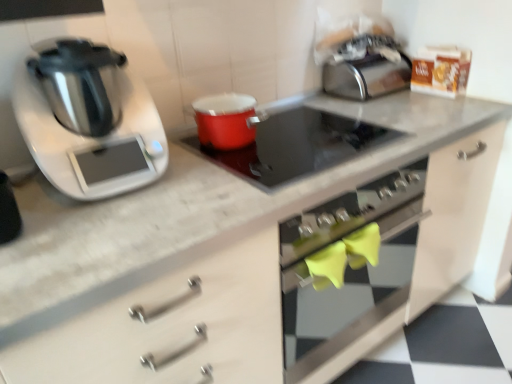
Question: Is shiny metallic pressure cooker at left not near smooth glass cooktop at center?

Choices:
 (A) yes
 (B) no

Answer: (B)

Question: Does shiny metallic pressure cooker at left appear on the right side of smooth glass cooktop at center?

Choices:
 (A) yes
 (B) no

Answer: (B)

Question: Is shiny metallic pressure cooker at left bigger than smooth glass cooktop at center?

Choices:
 (A) yes
 (B) no

Answer: (A)

Question: Is shiny metallic pressure cooker at left outside of smooth glass cooktop at center?

Choices:
 (A) yes
 (B) no

Answer: (A)

Question: Would you say smooth glass cooktop at center is part of shiny metallic pressure cooker at left's contents?

Choices:
 (A) yes
 (B) no

Answer: (B)

Question: Can you confirm if shiny metallic pressure cooker at left is smaller than smooth glass cooktop at center?

Choices:
 (A) no
 (B) yes

Answer: (A)

Question: Does smooth glass cooktop at center touch shiny metallic pressure cooker at left?

Choices:
 (A) no
 (B) yes

Answer: (A)

Question: Is smooth glass cooktop at center not inside shiny metallic pressure cooker at left?

Choices:
 (A) yes
 (B) no

Answer: (A)

Question: Is smooth glass cooktop at center positioned with its back to shiny metallic pressure cooker at left?

Choices:
 (A) no
 (B) yes

Answer: (A)

Question: Considering the relative positions of smooth glass cooktop at center and shiny metallic pressure cooker at left in the image provided, is smooth glass cooktop at center to the left of shiny metallic pressure cooker at left from the viewer's perspective?

Choices:
 (A) yes
 (B) no

Answer: (B)

Question: Is smooth glass cooktop at center oriented towards shiny metallic pressure cooker at left?

Choices:
 (A) no
 (B) yes

Answer: (A)

Question: From the image's perspective, is smooth glass cooktop at center beneath shiny metallic pressure cooker at left?

Choices:
 (A) yes
 (B) no

Answer: (A)

Question: Can you confirm if smooth glass cooktop at center is bigger than satin silver toaster at upper right?

Choices:
 (A) no
 (B) yes

Answer: (A)